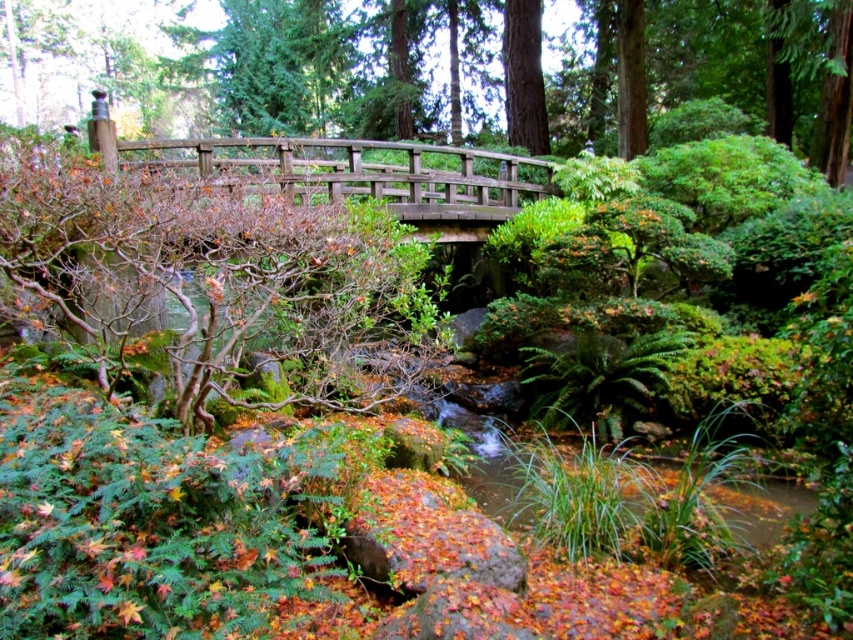
Between brown wooden bridge at upper center and green rough bark tree at upper center, which one is positioned lower?

Positioned lower is green rough bark tree at upper center.

The image size is (853, 640). I want to click on brown wooden bridge at upper center, so click(456, 70).